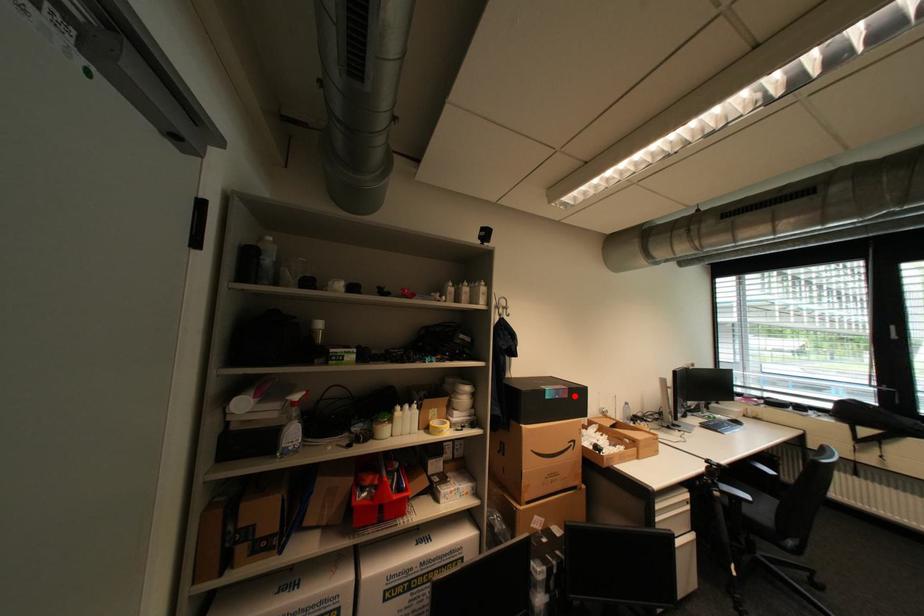
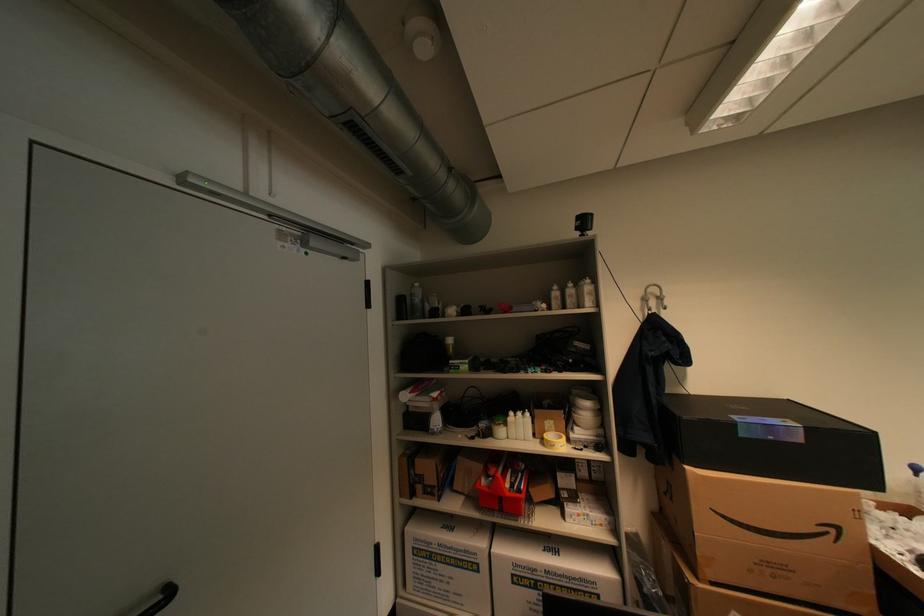
Locate, in the second image, the point that corresponds to the highlighted location in the first image.

(808, 440)